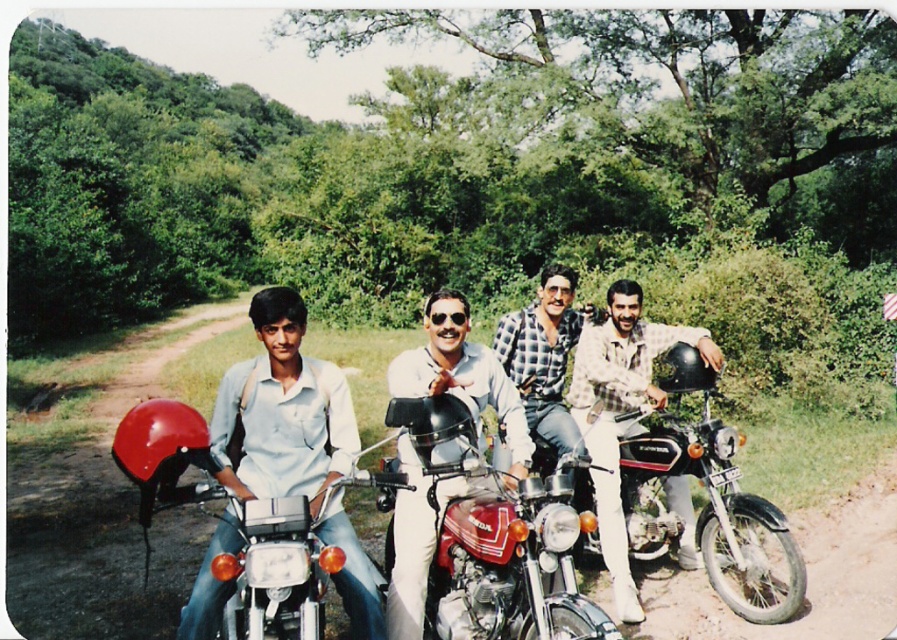
Can you confirm if shiny chrome motorcycle at center is positioned to the right of plaid shirt at center?

Incorrect, shiny chrome motorcycle at center is not on the right side of plaid shirt at center.

Does shiny chrome motorcycle at center have a greater height compared to plaid shirt at center?

No, shiny chrome motorcycle at center is not taller than plaid shirt at center.

Identify the location of shiny chrome motorcycle at center. (231, 525).

Does point (498, 486) come closer to viewer compared to point (527, 332)?

Yes, it is in front of point (527, 332).

What do you see at coordinates (495, 541) in the screenshot? The image size is (897, 640). I see `shiny red motorcycle at center` at bounding box center [495, 541].

Where is `shiny red motorcycle at center`? This screenshot has height=640, width=897. shiny red motorcycle at center is located at coordinates (495, 541).

Between plaid shirt at center and shiny silver helmet at center, which one is positioned lower?

plaid shirt at center is below.

Is point (649, 337) more distant than point (399, 577)?

Yes.

Where is `plaid shirt at center`? plaid shirt at center is located at coordinates (621, 412).